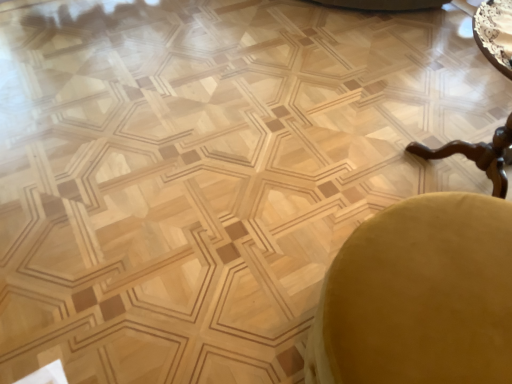
This screenshot has width=512, height=384. Identify the location of free region under wooden polished table at right (from a real-world perspective). (439, 170).